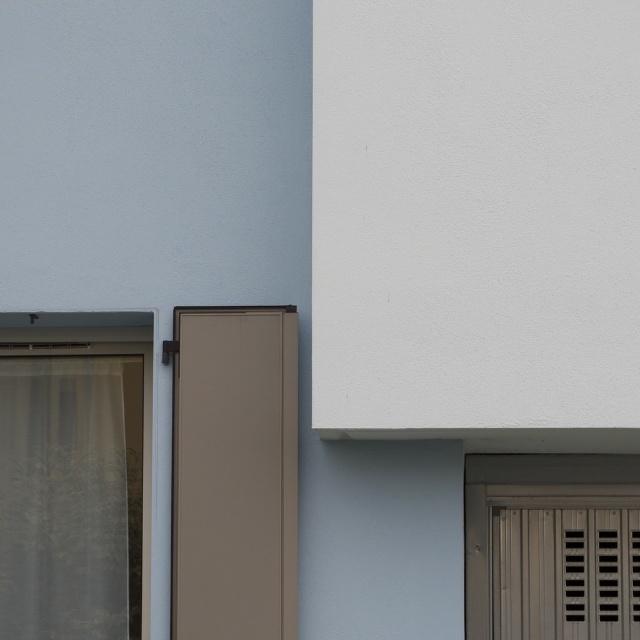
Question: Does sheer white curtain at left have a lesser width compared to matte gray slatted door at lower right?

Choices:
 (A) yes
 (B) no

Answer: (A)

Question: Which of the following is the farthest from the observer?

Choices:
 (A) matte brown screen door at center
 (B) matte gray slatted door at lower right
 (C) sheer white curtain at left

Answer: (C)

Question: Is matte brown screen door at center bigger than sheer white curtain at left?

Choices:
 (A) no
 (B) yes

Answer: (A)

Question: Estimate the real-world distances between objects in this image. Which object is farther from the matte brown screen door at center?

Choices:
 (A) sheer white curtain at left
 (B) matte gray slatted door at lower right

Answer: (B)

Question: Which of the following is the farthest from the observer?

Choices:
 (A) (252, 426)
 (B) (474, 568)
 (C) (109, 532)

Answer: (C)

Question: Is matte brown screen door at center thinner than matte gray slatted door at lower right?

Choices:
 (A) yes
 (B) no

Answer: (A)